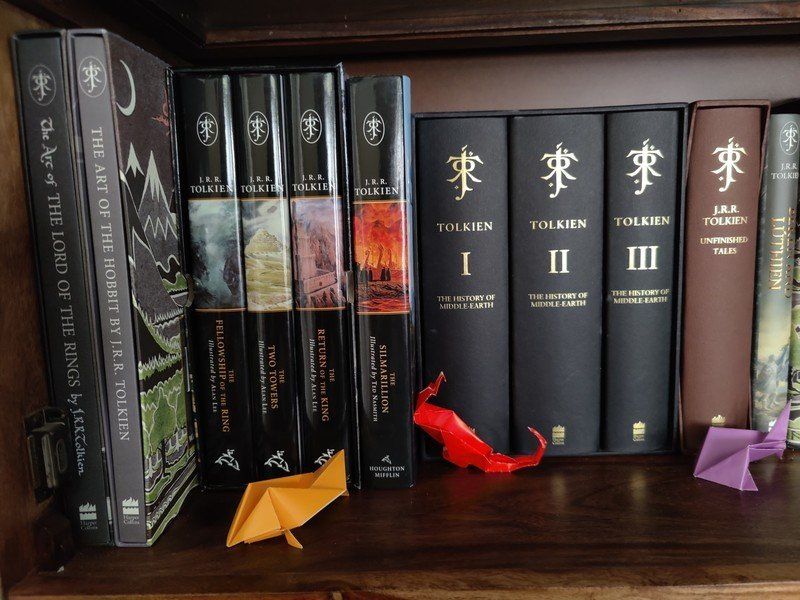
I want to click on grey spine of books, so click(74, 348), click(105, 362).